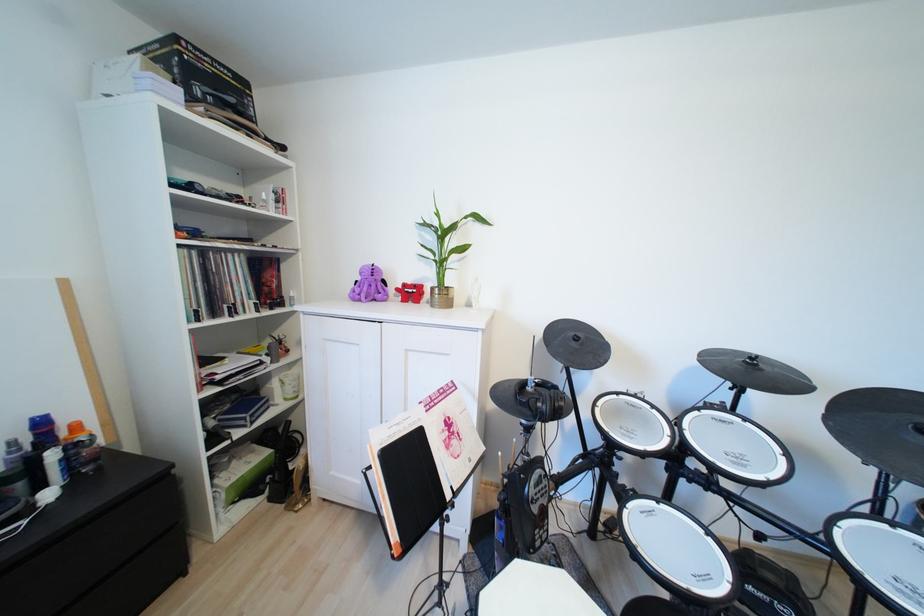
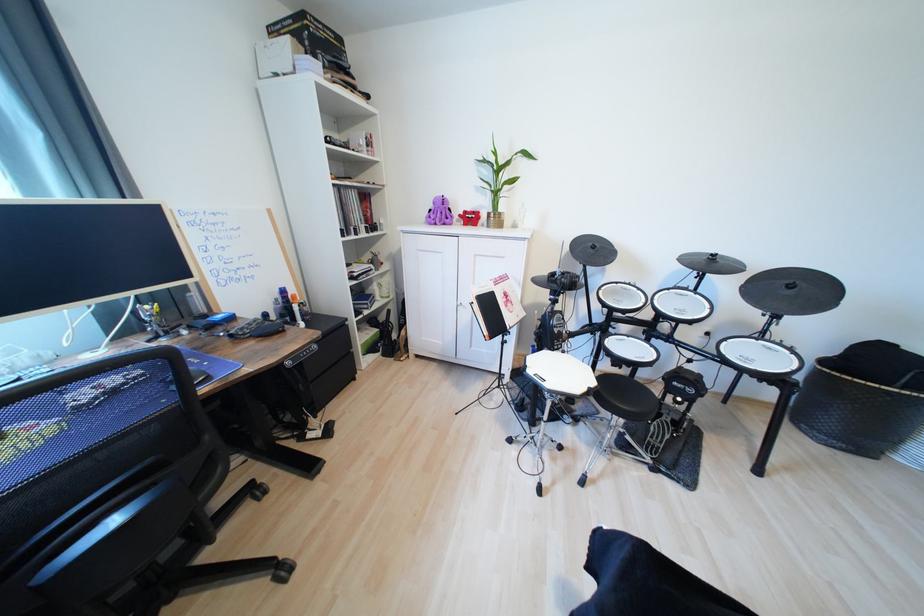
Locate, in the second image, the point that corresponds to point 379,288 in the first image.

(447, 216)